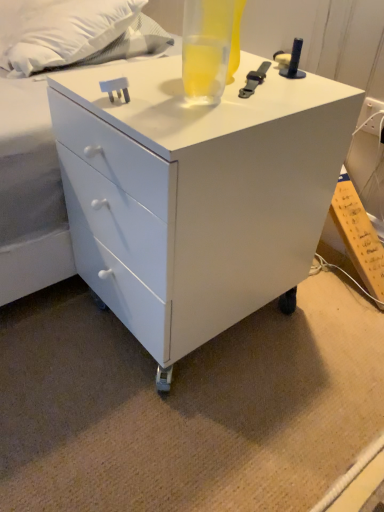
Identify the location of unoccupied region to the right of translucent glass beverage at top. This screenshot has width=384, height=512. (283, 89).